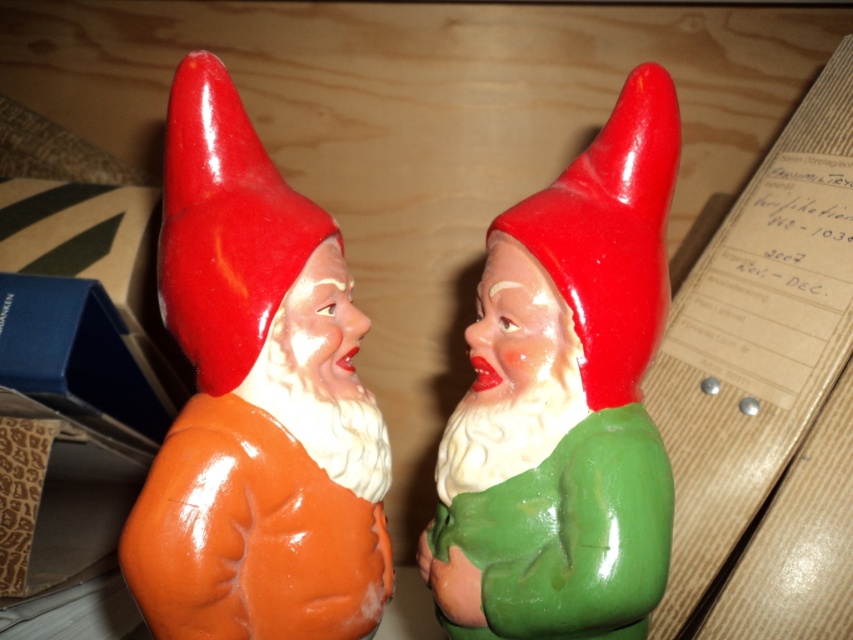
Question: Which object appears closest to the camera in this image?

Choices:
 (A) green glossy gnome at center
 (B) matte orange statue at left

Answer: (B)

Question: Does matte orange statue at left appear under green glossy gnome at center?

Choices:
 (A) no
 (B) yes

Answer: (A)

Question: Can you confirm if matte orange statue at left is smaller than green glossy gnome at center?

Choices:
 (A) no
 (B) yes

Answer: (B)

Question: Is matte orange statue at left wider than green glossy gnome at center?

Choices:
 (A) yes
 (B) no

Answer: (B)